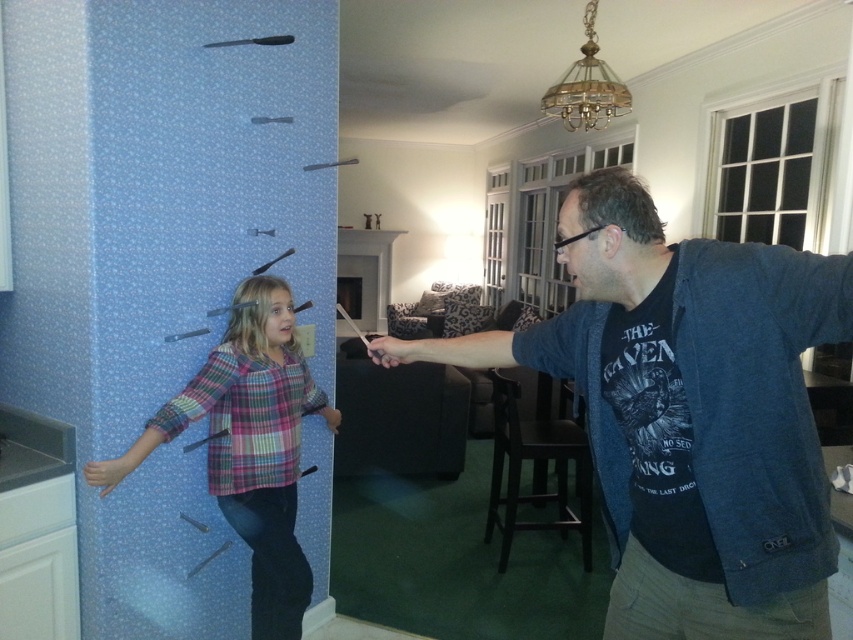
Is dark blue textured jacket at center right to the left of plaid fabric shirt at center from the viewer's perspective?

No, dark blue textured jacket at center right is not to the left of plaid fabric shirt at center.

Does dark blue textured jacket at center right have a lesser width compared to plaid fabric shirt at center?

No.

Is point (692, 481) farther from viewer compared to point (253, 467)?

No, (692, 481) is closer to viewer.

At what (x,y) coordinates should I click in order to perform the action: click on dark blue textured jacket at center right. Please return your answer as a coordinate pair (x, y). Looking at the image, I should click on (688, 413).